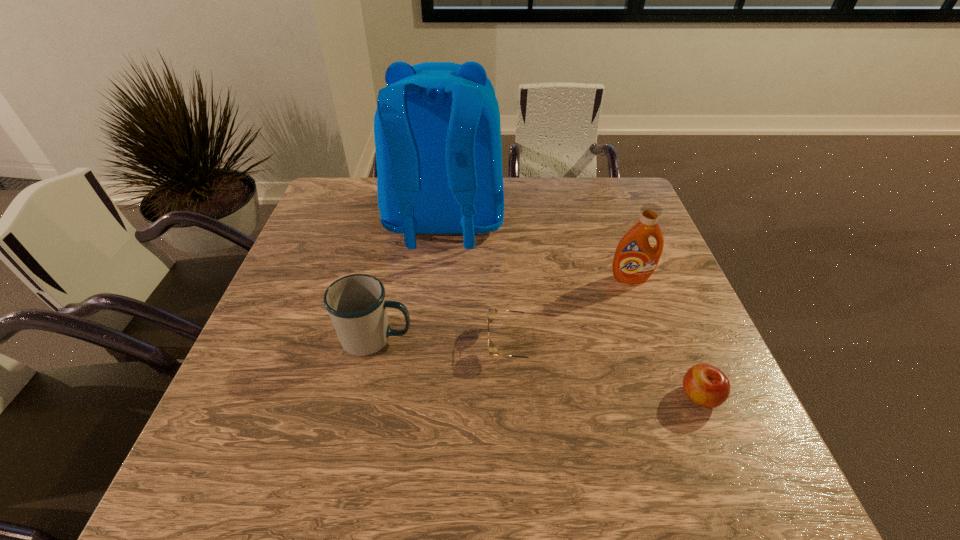
Image resolution: width=960 pixels, height=540 pixels. I want to click on vacant area that lies between the farthest object and the fourth tallest object, so click(572, 309).

This screenshot has height=540, width=960. In order to click on free spot between the sunglasses and the nearest object in this screenshot , I will do `click(606, 370)`.

This screenshot has height=540, width=960. I want to click on vacant region between the shortest object and the second shortest object, so click(606, 370).

Find the location of `free point between the shortest object and the nearest object`. free point between the shortest object and the nearest object is located at coordinates (606, 370).

You are a GUI agent. You are given a task and a screenshot of the screen. Output one action in this format:
    pyautogui.click(x=<x>, y=<y>)
    Task: Click on the free space that is in between the third shortest object and the nearest object
    
    Given the screenshot: What is the action you would take?
    pyautogui.click(x=538, y=367)

You are a GUI agent. You are given a task and a screenshot of the screen. Output one action in this format:
    pyautogui.click(x=<x>, y=<y>)
    Task: Click on the object that is the third closest to the detergent
    Image resolution: width=960 pixels, height=540 pixels.
    Given the screenshot: What is the action you would take?
    pyautogui.click(x=707, y=386)

Locate which object is the fourth closest to the shortest object. Please provide its 2D coordinates. Your answer should be formatted as a tuple, i.e. [(x, y)], where the tuple contains the x and y coordinates of a point satisfying the conditions above.

[(707, 386)]

You are a GUI agent. You are given a task and a screenshot of the screen. Output one action in this format:
    pyautogui.click(x=<x>, y=<y>)
    Task: Click on the vacant region that satisfies the following two spatial constraints: 1. on the front-facing side of the fourth nearest object; 2. on the front lenses of the shortest object
    This screenshot has height=540, width=960.
    Given the screenshot: What is the action you would take?
    pyautogui.click(x=654, y=343)

You are a GUI agent. You are given a task and a screenshot of the screen. Output one action in this format:
    pyautogui.click(x=<x>, y=<y>)
    Task: Click on the vacant space that satisfies the following two spatial constraints: 1. on the back of the farthest object; 2. on the right side of the nearest object
    
    Given the screenshot: What is the action you would take?
    pyautogui.click(x=427, y=396)

The image size is (960, 540). Identify the location of vacant space that satisfies the following two spatial constraints: 1. on the handle side of the mug; 2. on the left side of the apple. (363, 396).